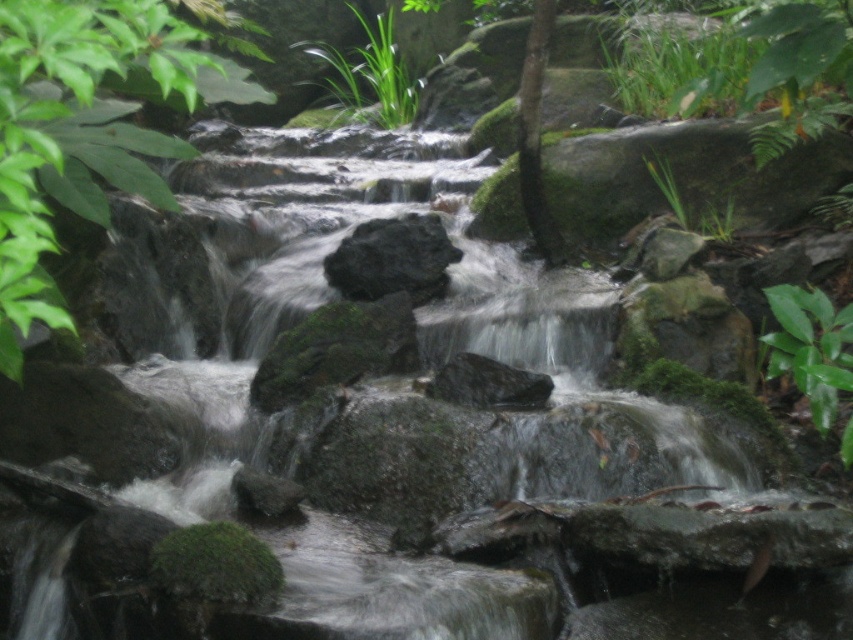
In the scene shown: You are a photographer trying to capture the green leafy plant at upper left and the green matte leaf at upper right in the same frame. Which object should you focus on if you want both to be in focus?

The green leafy plant at upper left is larger in size than the green matte leaf at upper right, so focusing on the green leafy plant at upper left would ensure both are in focus.

You are standing at the edge of the stream and want to place a small decorative stone at each of the two points labeled point (x=59, y=161) and point (x=538, y=76). Which point is closer to you where you can place the stone without needing to bend down too much?

Point (x=59, y=161) is closer to the viewer than point (x=538, y=76), so placing the stone there would require less bending down.